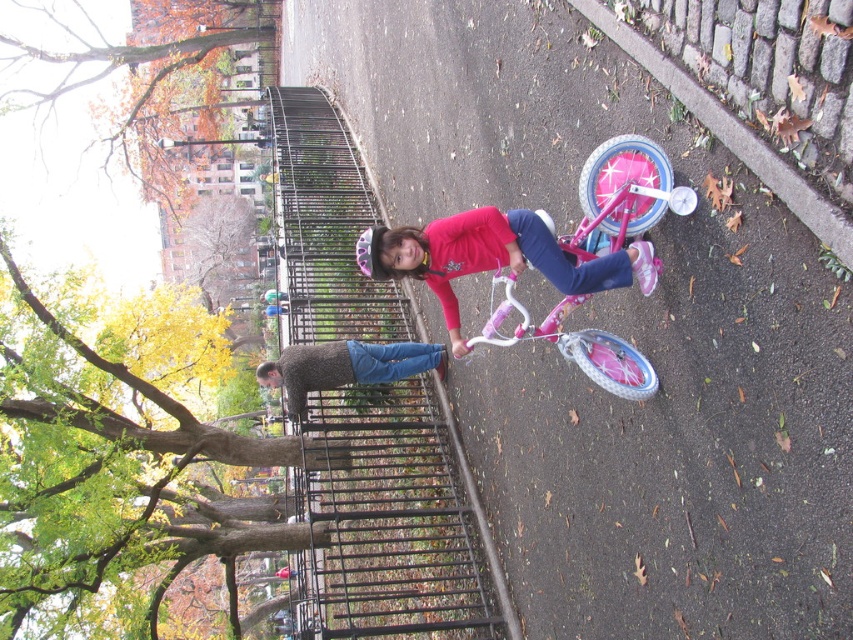
Question: Is pink metallic bicycle at center thinner than pink glossy bicycle at center?

Choices:
 (A) yes
 (B) no

Answer: (A)

Question: Does pink glossy bicycle at center appear under knitted sweater at center?

Choices:
 (A) no
 (B) yes

Answer: (A)

Question: Where is pink metallic bicycle at center located in relation to knitted sweater at center in the image?

Choices:
 (A) right
 (B) left

Answer: (A)

Question: Based on their relative distances, which object is farther from the pink metallic bicycle at center?

Choices:
 (A) pink glossy bicycle at center
 (B) knitted sweater at center

Answer: (B)

Question: Which point appears closest to the camera in this image?

Choices:
 (A) (511, 275)
 (B) (451, 298)

Answer: (A)

Question: Among these points, which one is farthest from the camera?

Choices:
 (A) (341, 356)
 (B) (666, 166)
 (C) (590, 278)

Answer: (A)